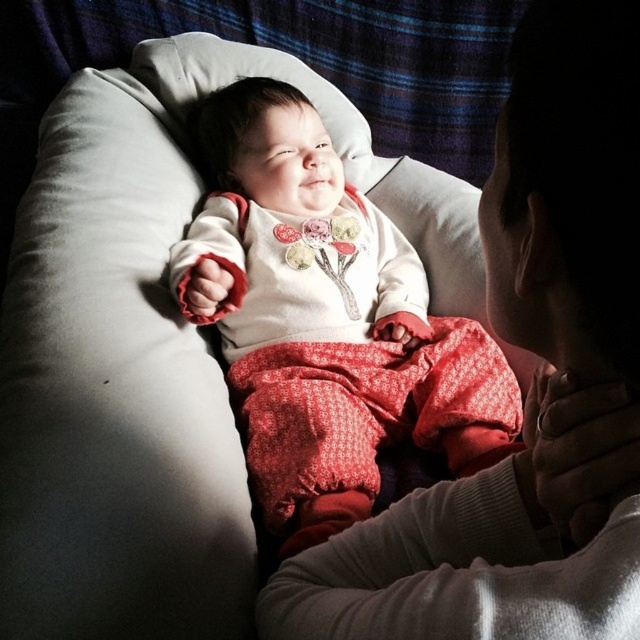
Question: Which point is closer to the camera?

Choices:
 (A) white soft fabric at upper center
 (B) white soft fabric baby at center

Answer: (A)

Question: Which object appears closest to the camera in this image?

Choices:
 (A) white soft fabric baby at center
 (B) white soft fabric at upper center

Answer: (B)

Question: Is white soft fabric at upper center to the left of white soft fabric baby at center from the viewer's perspective?

Choices:
 (A) no
 (B) yes

Answer: (A)

Question: Can you confirm if white soft fabric at upper center is positioned to the right of white soft fabric baby at center?

Choices:
 (A) no
 (B) yes

Answer: (B)

Question: Can you confirm if white soft fabric at upper center is positioned above white soft fabric baby at center?

Choices:
 (A) yes
 (B) no

Answer: (B)